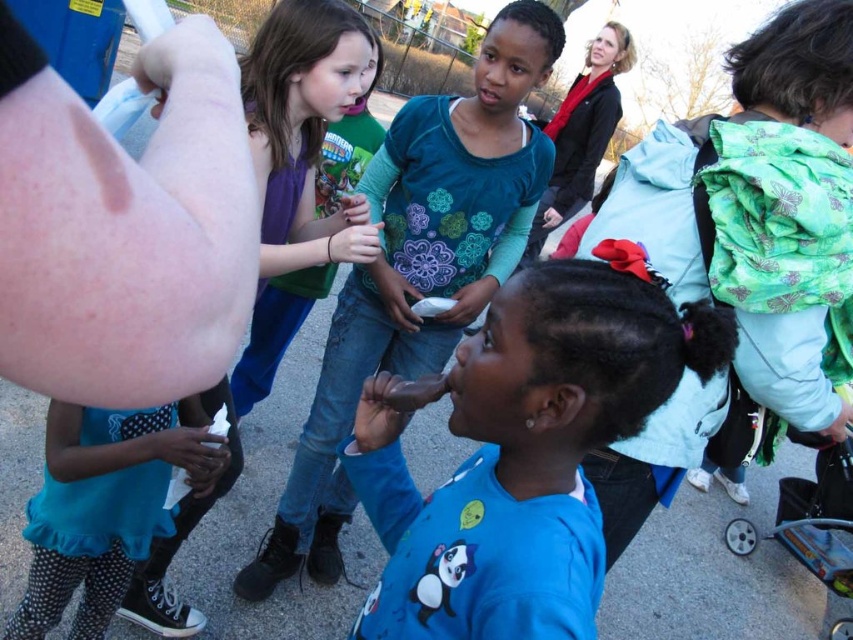
Question: Which of these objects is positioned closest to the matte purple tank top at center?

Choices:
 (A) blue matte shirt at center
 (B) blue cotton shirt at center

Answer: (B)

Question: Observing the image, what is the correct spatial positioning of blue cotton shirt at center in reference to matte purple tank top at center?

Choices:
 (A) right
 (B) left

Answer: (A)

Question: Is blue matte shirt at center smaller than blue cotton shirt at center?

Choices:
 (A) yes
 (B) no

Answer: (A)

Question: Which point is farther from the camera taking this photo?

Choices:
 (A) (581, 577)
 (B) (282, 163)

Answer: (B)

Question: Considering the real-world distances, which object is farthest from the blue matte shirt at center?

Choices:
 (A) blue cotton shirt at center
 (B) matte purple tank top at center

Answer: (A)

Question: Is blue matte shirt at center wider than blue cotton shirt at center?

Choices:
 (A) yes
 (B) no

Answer: (B)